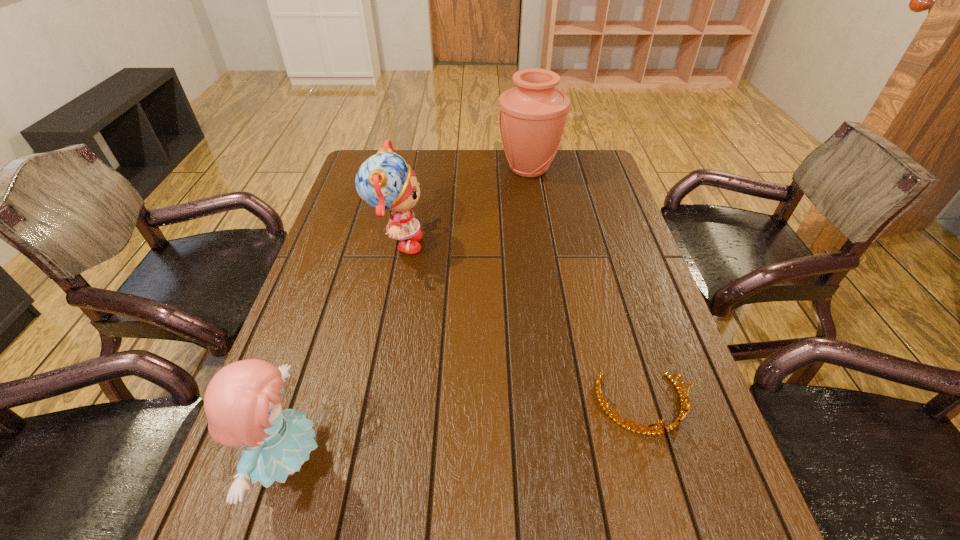
The height and width of the screenshot is (540, 960). What are the coordinates of `object that is the third nearest to the vase` in the screenshot? It's located at (242, 403).

Find the location of `vacant region that satisfies the following two spatial constraints: 1. on the front-facing side of the tiara; 2. on the front-facing side of the nearer doll`. vacant region that satisfies the following two spatial constraints: 1. on the front-facing side of the tiara; 2. on the front-facing side of the nearer doll is located at coordinates (659, 461).

Identify the location of free space that satisfies the following two spatial constraints: 1. on the front side of the vase; 2. on the front-facing side of the nearer doll. Image resolution: width=960 pixels, height=540 pixels. (573, 461).

At what (x,y) coordinates should I click in order to perform the action: click on vacant space that satisfies the following two spatial constraints: 1. on the front-facing side of the tiara; 2. on the front-facing side of the nearer doll. Please return your answer as a coordinate pair (x, y). Image resolution: width=960 pixels, height=540 pixels. Looking at the image, I should click on (659, 461).

Where is `vacant space that satisfies the following two spatial constraints: 1. on the front side of the vase; 2. on the front-facing side of the nearer doll`? vacant space that satisfies the following two spatial constraints: 1. on the front side of the vase; 2. on the front-facing side of the nearer doll is located at coordinates (573, 461).